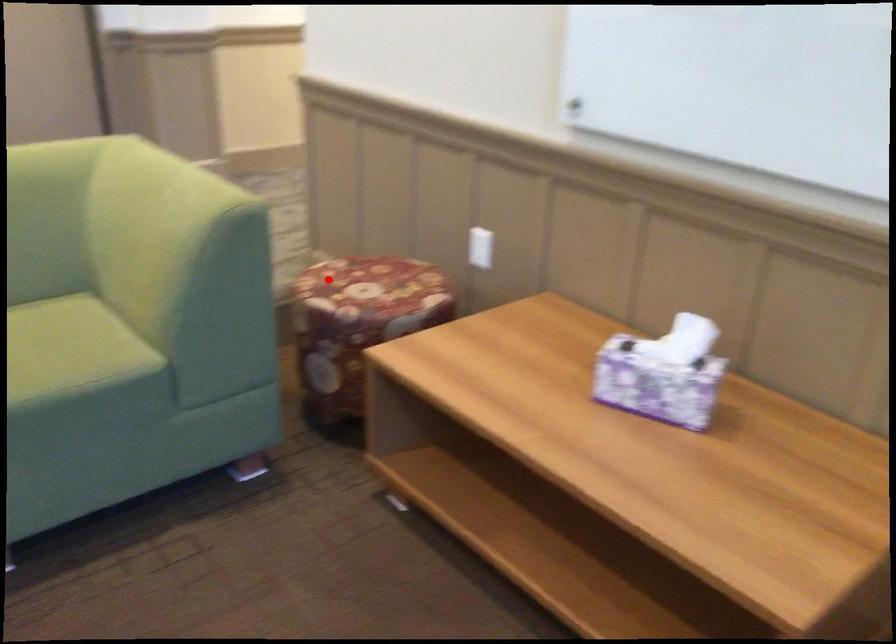
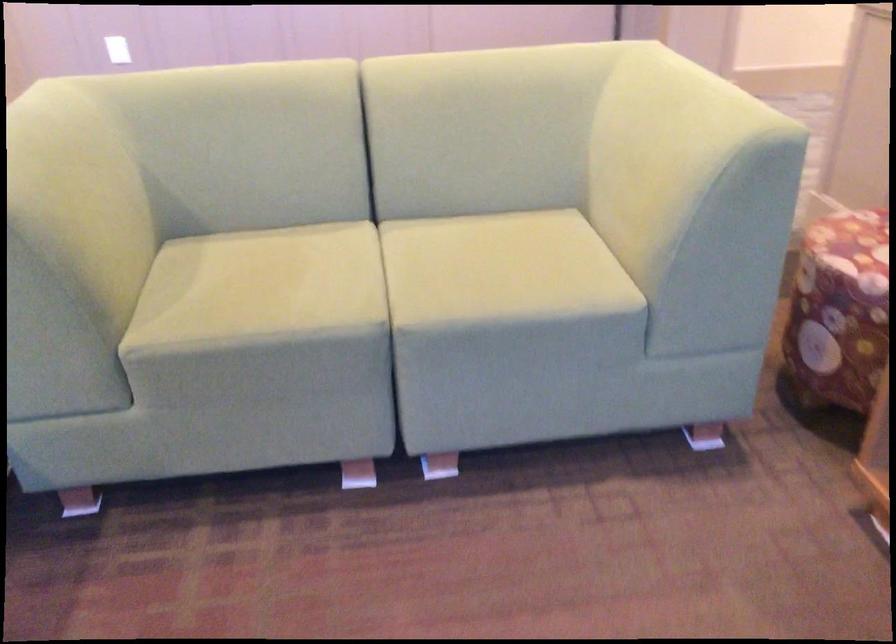
Locate, in the second image, the point that corresponds to the highlighted location in the first image.

(851, 231)